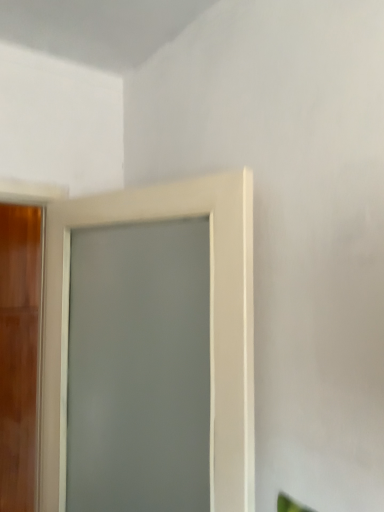
Locate an element on the screen. The height and width of the screenshot is (512, 384). wooden door at left is located at coordinates (19, 353).

The image size is (384, 512). Describe the element at coordinates (19, 353) in the screenshot. I see `wooden door at left` at that location.

Where is `wooden door at left`? wooden door at left is located at coordinates (19, 353).